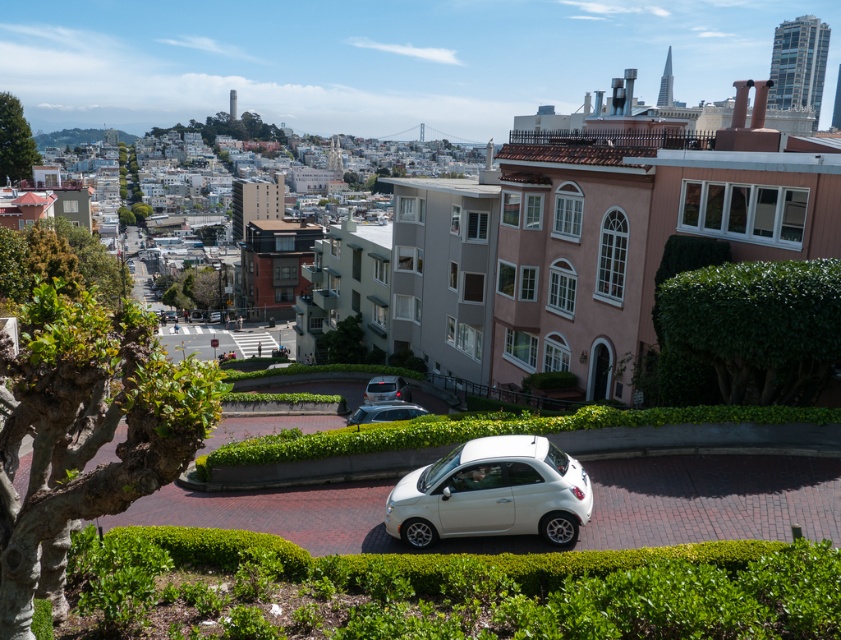
Question: Estimate the real-world distances between objects in this image. Which object is farther from the white matte car at center?

Choices:
 (A) satin black car at center
 (B) satin silver car at center
 (C) green leafy hedge at center right
 (D) green leafy hedge at center

Answer: (A)

Question: Which of the following is the closest to the observer?

Choices:
 (A) (392, 410)
 (B) (707, 339)
 (C) (549, 483)

Answer: (C)

Question: Is green leafy hedge at center right below white matte car at center?

Choices:
 (A) yes
 (B) no

Answer: (B)

Question: From the image, what is the correct spatial relationship of green leafy hedge at center in relation to satin black car at center?

Choices:
 (A) above
 (B) below

Answer: (B)

Question: Is green leafy hedge at center right positioned at the back of satin silver car at center?

Choices:
 (A) yes
 (B) no

Answer: (B)

Question: Which object is closer to the camera taking this photo?

Choices:
 (A) white matte car at center
 (B) satin black car at center
 (C) green leafy hedge at center
 (D) green leafy hedge at center right

Answer: (C)